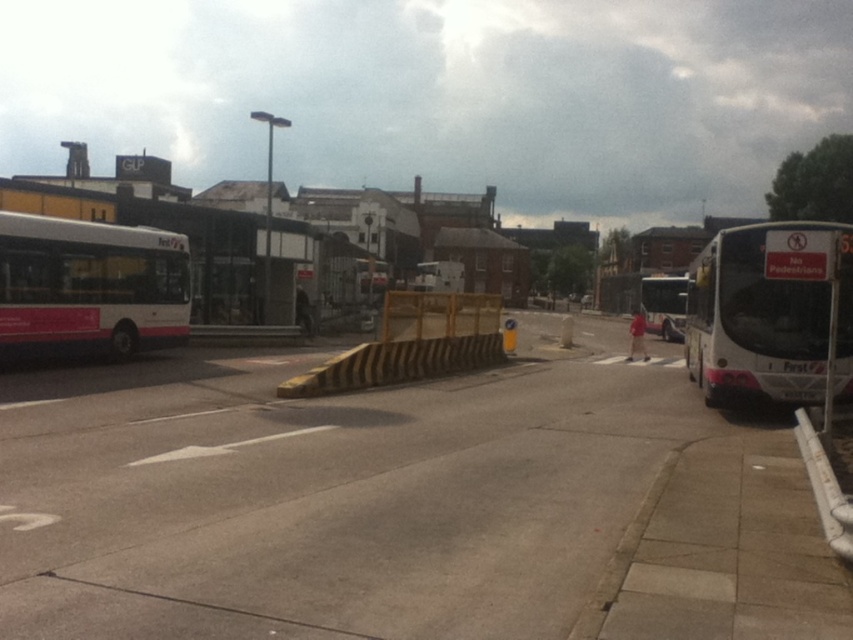
You are a delivery driver trying to navigate through the urban street scene. You need to pass between the yellow striped plastic barricade at center and the white plastic curb at lower right. Can you estimate whether the space between them is wide enough for your delivery van, which is 2 meters wide?

The yellow striped plastic barricade at center might be wider than white plastic curb at lower right, but without exact measurements, it is uncertain if the space is wide enough for a 2 meter wide delivery van. Proceed with caution or measure the gap first.

You are a pedestrian standing at the edge of the road and want to cross to the bus stop shelter on the left. The yellow striped plastic barricade at center and the white plastic curb at lower right are in your path. Which object do you need to step over to proceed safely?

The yellow striped plastic barricade at center is positioned over the white plastic curb at lower right. To proceed safely, you need to step over the yellow striped plastic barricade at center first before reaching the white plastic curb at lower right.

You are standing at the bus stop shelter and want to walk to the yellow and black striped barrier. Which point, point (450, 342) or point (670, 292), is closer to your starting position?

Point (450, 342) is in front of point (670, 292), so it is closer to your starting position at the bus stop shelter.